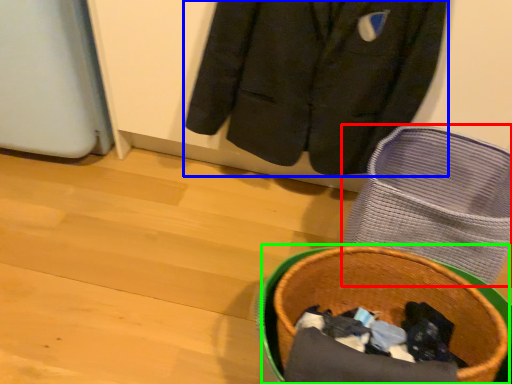
Question: Considering the real-world distances, which object is farthest from footwear (highlighted by a red box)? jacket (highlighted by a blue box) or basket container (highlighted by a green box)?

Choices:
 (A) jacket
 (B) basket container

Answer: (B)